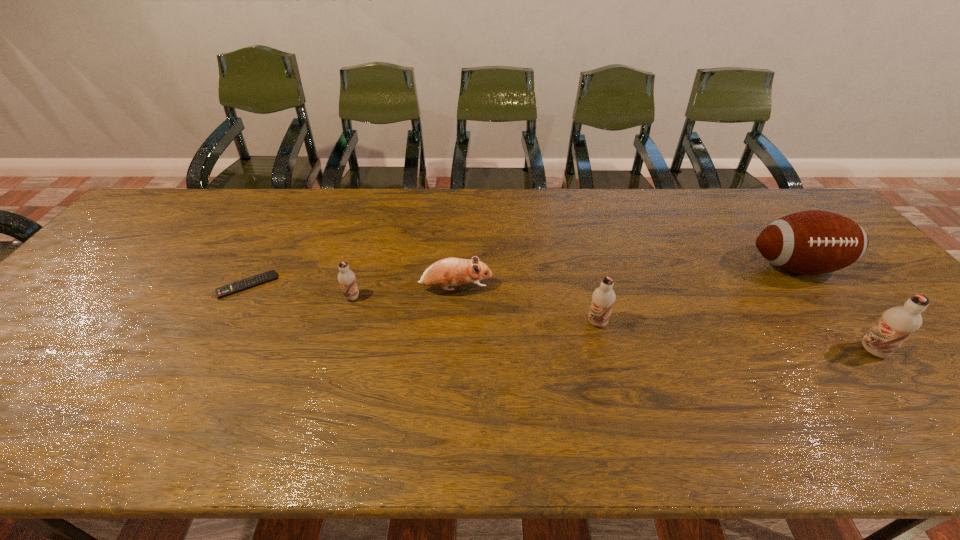
At what (x,y) coordinates should I click in order to perform the action: click on free spot at the near edge of the desktop. Please return your answer as a coordinate pair (x, y). The height and width of the screenshot is (540, 960). Looking at the image, I should click on (797, 370).

In the image, there is a desktop. What are the coordinates of `free space at the left edge` in the screenshot? It's located at (38, 354).

You are a GUI agent. You are given a task and a screenshot of the screen. Output one action in this format:
    pyautogui.click(x=<x>, y=<y>)
    Task: Click on the free location at the right edge
    
    Given the screenshot: What is the action you would take?
    pyautogui.click(x=824, y=279)

The image size is (960, 540). I want to click on vacant space at the far left corner of the desktop, so click(x=194, y=204).

In the image, there is a desktop. At what (x,y) coordinates should I click in order to perform the action: click on vacant area at the near right corner. Please return your answer as a coordinate pair (x, y). Image resolution: width=960 pixels, height=540 pixels. Looking at the image, I should click on (935, 379).

Where is `vacant area between the shortest chocolate milk and the second tallest chocolate milk`? vacant area between the shortest chocolate milk and the second tallest chocolate milk is located at coordinates (474, 310).

The width and height of the screenshot is (960, 540). What are the coordinates of `free space between the third shortest object and the second shortest object` in the screenshot? It's located at (404, 293).

Where is `empty space that is in between the farthest chocolate milk and the football`? The width and height of the screenshot is (960, 540). empty space that is in between the farthest chocolate milk and the football is located at coordinates (574, 282).

The height and width of the screenshot is (540, 960). Identify the location of free space between the remote control and the football. (521, 276).

At what (x,y) coordinates should I click in order to perform the action: click on vacant area between the fourth shortest object and the leftmost object. Please return your answer as a coordinate pair (x, y). Image resolution: width=960 pixels, height=540 pixels. Looking at the image, I should click on (422, 304).